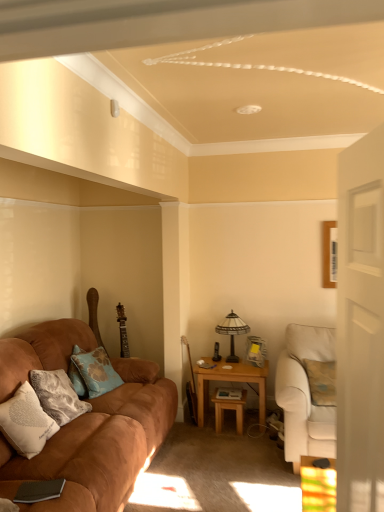
Question: Is stained glass lampshade at center-right surrounded by blue fabric pillow at left, which is counted as the second pillow, starting from the front?

Choices:
 (A) yes
 (B) no

Answer: (B)

Question: Is blue fabric pillow at left, which is counted as the second pillow, starting from the front, taller than stained glass lampshade at center-right?

Choices:
 (A) yes
 (B) no

Answer: (B)

Question: Is blue fabric pillow at left, which is counted as the second pillow, starting from the front, further to camera compared to stained glass lampshade at center-right?

Choices:
 (A) yes
 (B) no

Answer: (B)

Question: From the image's perspective, is blue fabric pillow at left, which is counted as the second pillow, starting from the front, beneath stained glass lampshade at center-right?

Choices:
 (A) no
 (B) yes

Answer: (B)

Question: Is blue fabric pillow at left, the 1th pillow positioned from the back, not close to stained glass lampshade at center-right?

Choices:
 (A) no
 (B) yes

Answer: (B)

Question: Considering the positions of point (259, 420) and point (18, 400), is point (259, 420) closer or farther from the camera than point (18, 400)?

Choices:
 (A) farther
 (B) closer

Answer: (A)

Question: Is light brown wooden table at center right, which is counted as the 1th table, starting from the right, in front of or behind white soft pillow at lower left, the 2th pillow from the back, in the image?

Choices:
 (A) front
 (B) behind

Answer: (B)

Question: In terms of height, does light brown wooden table at center right, which is counted as the 1th table, starting from the right, look taller or shorter compared to white soft pillow at lower left, the 2th pillow from the back?

Choices:
 (A) short
 (B) tall

Answer: (B)

Question: From a real-world perspective, is light brown wooden table at center right, which is counted as the 1th table, starting from the right, physically located above or below white soft pillow at lower left, the 2th pillow from the back?

Choices:
 (A) above
 (B) below

Answer: (B)

Question: Visually, is wooden table at center, placed as the first table when sorted from left to right, positioned to the left or to the right of beige fabric armchair at right, the first studio couch positioned from the right?

Choices:
 (A) left
 (B) right

Answer: (A)

Question: From the image's perspective, is wooden table at center, acting as the 2th table starting from the right, above or below beige fabric armchair at right, the first studio couch positioned from the right?

Choices:
 (A) above
 (B) below

Answer: (B)

Question: Based on their sizes in the image, would you say wooden table at center, acting as the 2th table starting from the right, is bigger or smaller than beige fabric armchair at right, the first studio couch positioned from the right?

Choices:
 (A) small
 (B) big

Answer: (A)

Question: Is point (215, 397) positioned closer to the camera than point (304, 391)?

Choices:
 (A) closer
 (B) farther

Answer: (B)

Question: Is point (44, 504) closer or farther from the camera than point (370, 222)?

Choices:
 (A) farther
 (B) closer

Answer: (A)

Question: Considering their positions, is suede brown couch at left, the second studio couch from the right, located in front of or behind white glossy door at right?

Choices:
 (A) behind
 (B) front

Answer: (A)